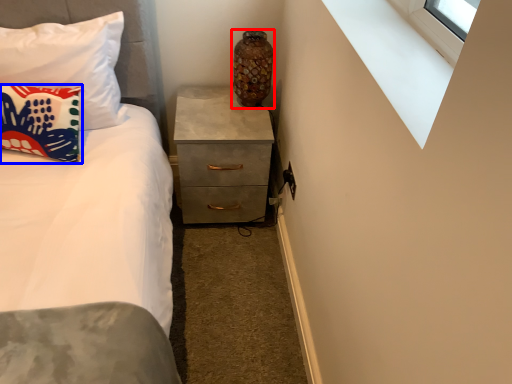
Question: Among these objects, which one is farthest to the camera, vase (highlighted by a red box) or pillow (highlighted by a blue box)?

Choices:
 (A) vase
 (B) pillow

Answer: (A)